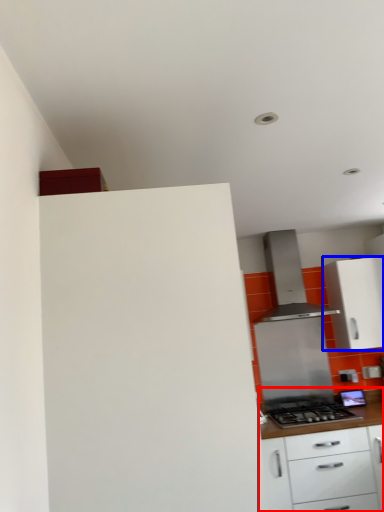
Question: Which of the following is the farthest to the observer, cabinetry (highlighted by a red box) or cabinetry (highlighted by a blue box)?

Choices:
 (A) cabinetry
 (B) cabinetry

Answer: (B)